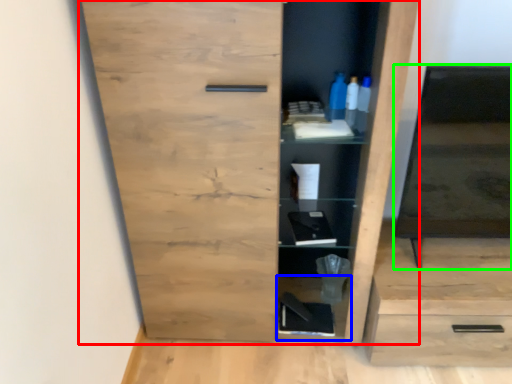
Question: Estimate the real-world distances between objects in this image. Which object is closer to cupboard (highlighted by a red box), cabinet (highlighted by a blue box) or medicine cabinet (highlighted by a green box)?

Choices:
 (A) cabinet
 (B) medicine cabinet

Answer: (B)